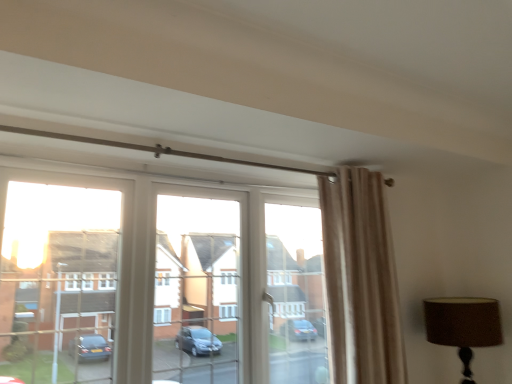
Question: Is transparent glass window at center facing towards beige velvet curtain at upper right?

Choices:
 (A) yes
 (B) no

Answer: (A)

Question: From the image's perspective, is transparent glass window at center under beige velvet curtain at upper right?

Choices:
 (A) yes
 (B) no

Answer: (A)

Question: Would you consider transparent glass window at center to be distant from beige velvet curtain at upper right?

Choices:
 (A) yes
 (B) no

Answer: (B)

Question: Does transparent glass window at center appear on the right side of beige velvet curtain at upper right?

Choices:
 (A) no
 (B) yes

Answer: (A)

Question: Is transparent glass window at center with beige velvet curtain at upper right?

Choices:
 (A) yes
 (B) no

Answer: (B)

Question: From a real-world perspective, is transparent glass window at center physically located above or below brown fabric lampshade at upper right?

Choices:
 (A) below
 (B) above

Answer: (B)

Question: Is point (249, 241) closer or farther from the camera than point (441, 329)?

Choices:
 (A) farther
 (B) closer

Answer: (A)

Question: Considering the positions of transparent glass window at center and brown fabric lampshade at upper right in the image, is transparent glass window at center wider or thinner than brown fabric lampshade at upper right?

Choices:
 (A) thin
 (B) wide

Answer: (A)

Question: Is transparent glass window at center spatially inside brown fabric lampshade at upper right, or outside of it?

Choices:
 (A) inside
 (B) outside

Answer: (B)

Question: In the image, is beige velvet curtain at upper right positioned in front of or behind brown fabric lampshade at upper right?

Choices:
 (A) behind
 (B) front

Answer: (B)

Question: Would you say beige velvet curtain at upper right is to the left or to the right of brown fabric lampshade at upper right in the picture?

Choices:
 (A) left
 (B) right

Answer: (A)

Question: From the image's perspective, is beige velvet curtain at upper right positioned above or below brown fabric lampshade at upper right?

Choices:
 (A) above
 (B) below

Answer: (A)

Question: Would you say beige velvet curtain at upper right is inside or outside brown fabric lampshade at upper right?

Choices:
 (A) inside
 (B) outside

Answer: (B)

Question: Considering the positions of brown fabric lampshade at upper right and beige velvet curtain at upper right in the image, is brown fabric lampshade at upper right wider or thinner than beige velvet curtain at upper right?

Choices:
 (A) thin
 (B) wide

Answer: (B)

Question: Considering the positions of brown fabric lampshade at upper right and beige velvet curtain at upper right in the image, is brown fabric lampshade at upper right taller or shorter than beige velvet curtain at upper right?

Choices:
 (A) tall
 (B) short

Answer: (B)